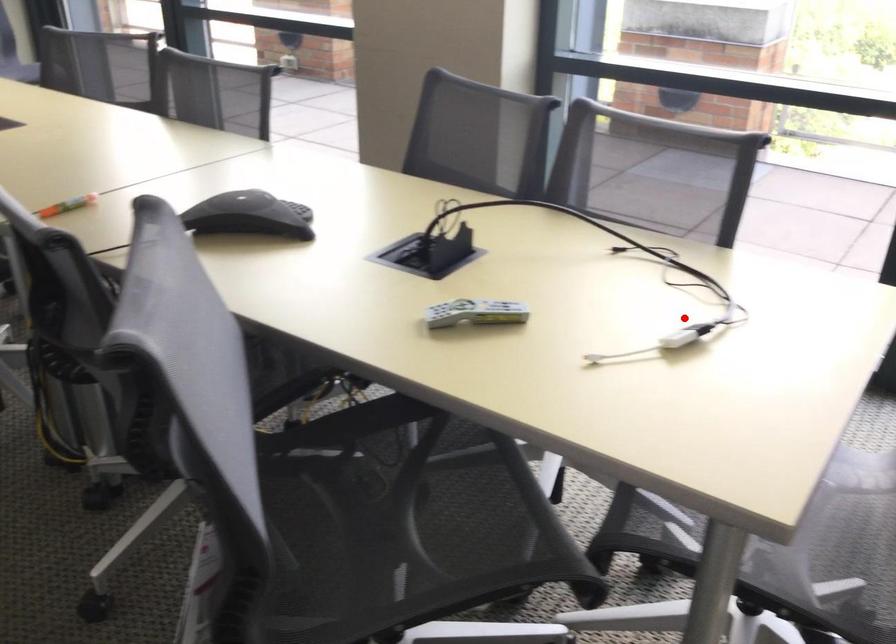
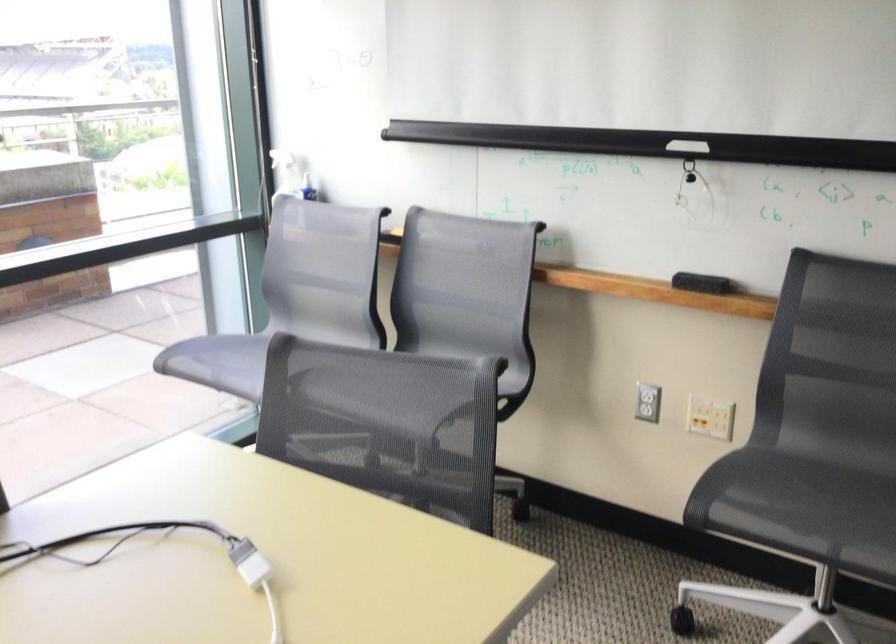
Question: I am providing you with two images of the same scene from different viewpoints. A red point is shown in image1. For the corresponding object point in image2, is it positioned nearer or farther from the camera?

Choices:
 (A) Nearer
 (B) Farther

Answer: (A)